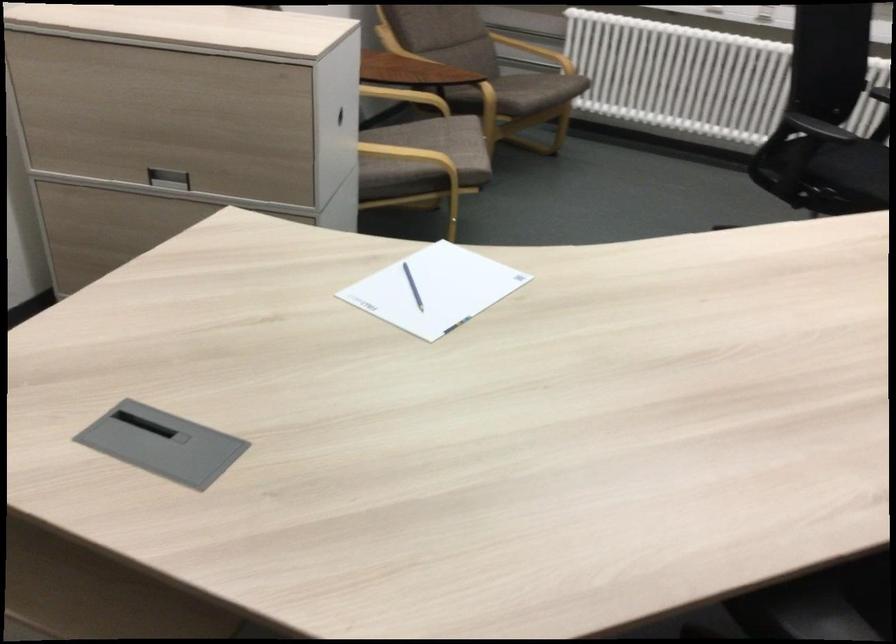
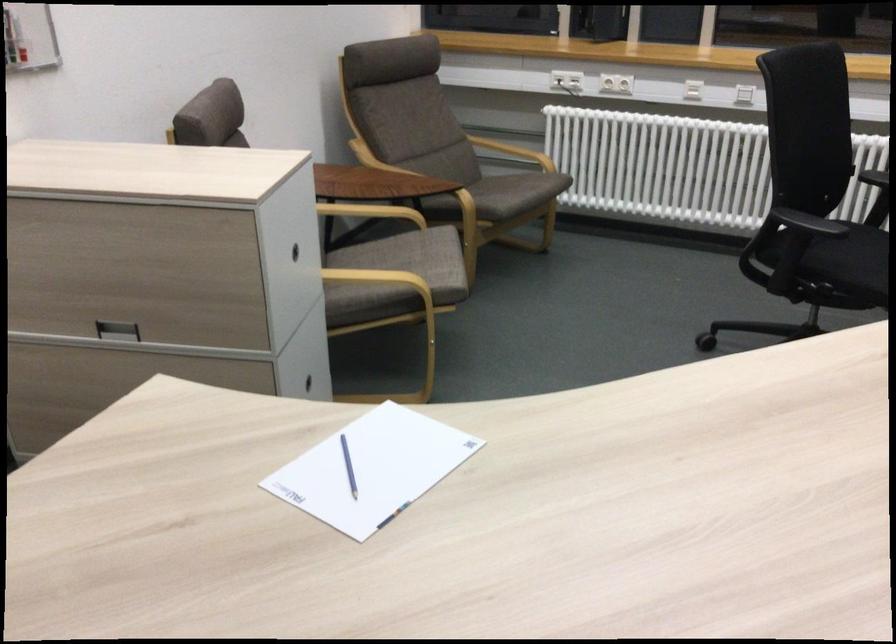
The point at (400, 96) is marked in the first image. Where is the corresponding point in the second image?

(371, 212)